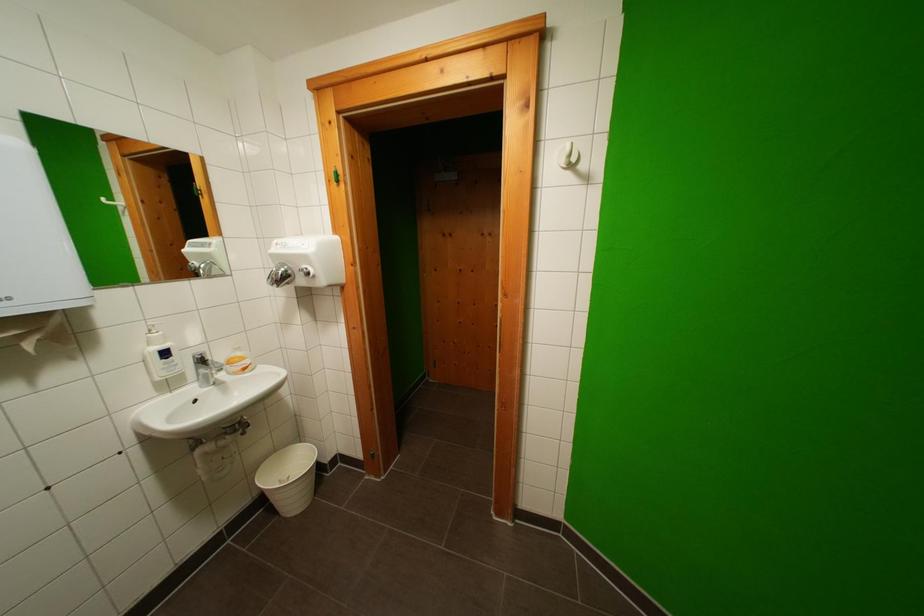
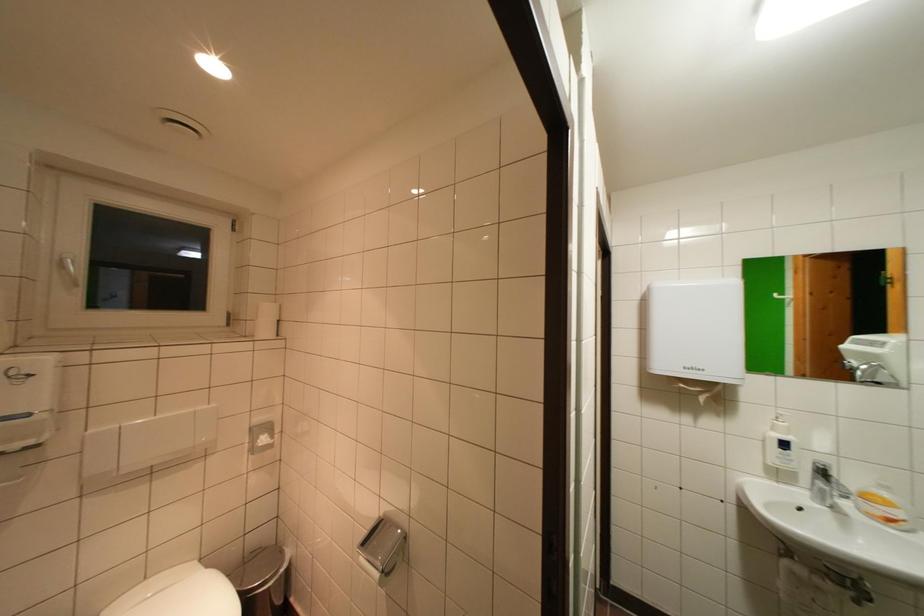
Find the pixel in the second image that matches (117,203) in the first image.

(788, 297)